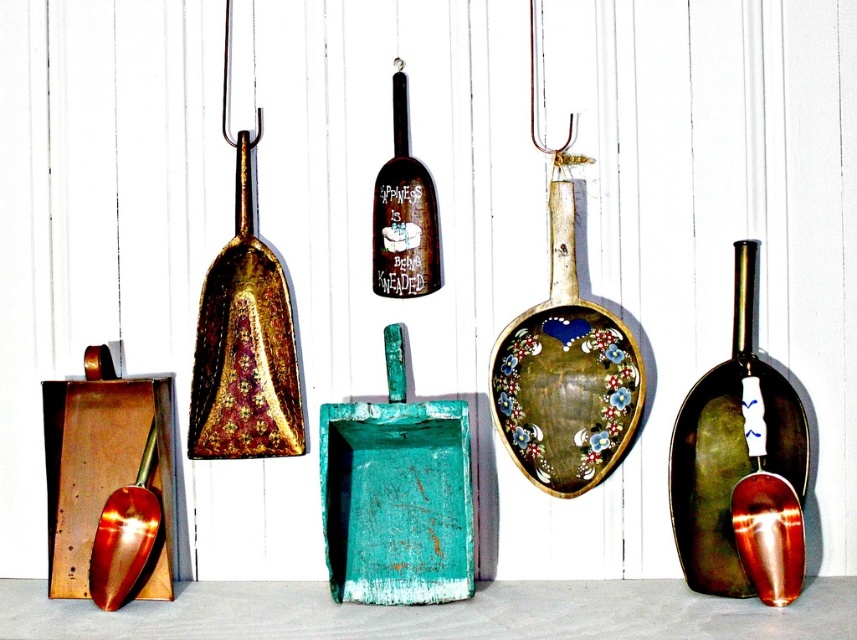
You are standing in front of the decorative items displayed on the white wooden background. There are two points marked on the image at coordinates point (756, 476) and point (124, 572). Which point is nearer to you?

Point (756, 476) is closer to the viewer than point (124, 572).

You are arranging these decorative shovels on a narrow shelf that can only accommodate the width of the brushed gold shovel at lower left. Can the shiny metallic shovel at right fit on the same shelf without overlapping?

The shiny metallic shovel at right is wider than the brushed gold shovel at lower left, so it cannot fit on the shelf designed for the narrower shovel without overlapping.